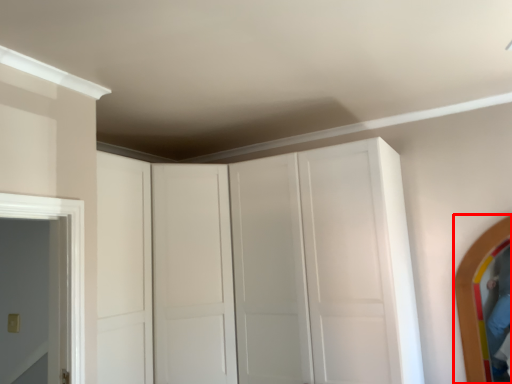
Question: From the image's perspective, what is the correct spatial relationship of mirror (annotated by the red box) in relation to dresser?

Choices:
 (A) below
 (B) above

Answer: (A)